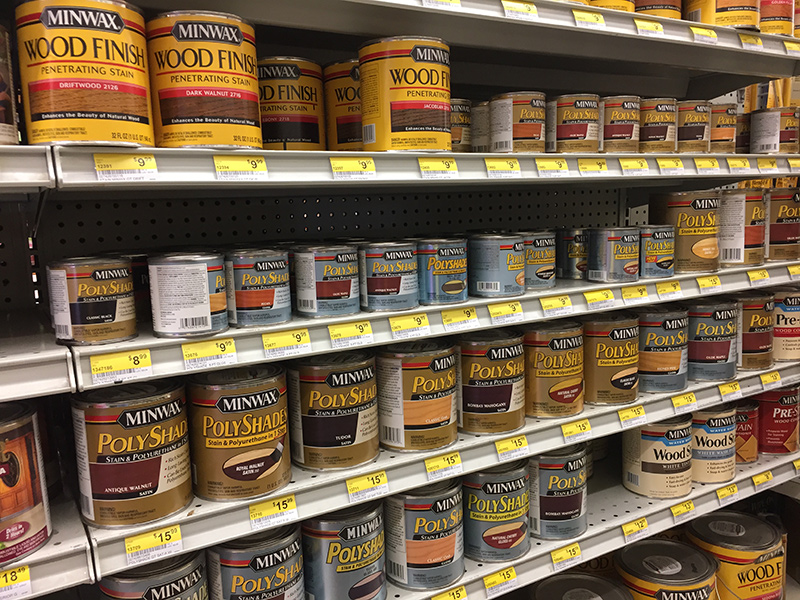
Where is `shelf backing`? shelf backing is located at coordinates (333, 223).